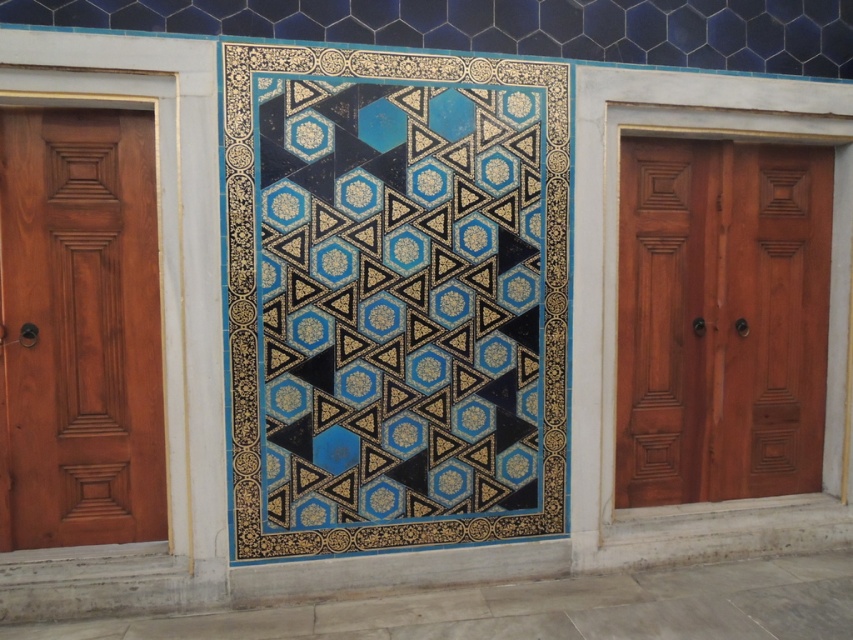
Question: Can you confirm if mahogany wood door at right is smaller than mahogany wood door at left?

Choices:
 (A) yes
 (B) no

Answer: (B)

Question: From the image, what is the correct spatial relationship of mahogany wood door at right in relation to mahogany wood door at left?

Choices:
 (A) left
 (B) right

Answer: (B)

Question: Is blue glossy tile at center wider than mahogany wood door at right?

Choices:
 (A) no
 (B) yes

Answer: (B)

Question: Which point is closer to the camera?

Choices:
 (A) blue glossy tile at center
 (B) mahogany wood door at left

Answer: (A)

Question: Which of these objects is positioned closest to the blue glossy tile at center?

Choices:
 (A) mahogany wood door at right
 (B) mahogany wood door at left

Answer: (B)

Question: Which object is closer to the camera taking this photo?

Choices:
 (A) blue glossy tile at center
 (B) mahogany wood door at left
 (C) mahogany wood door at right

Answer: (A)